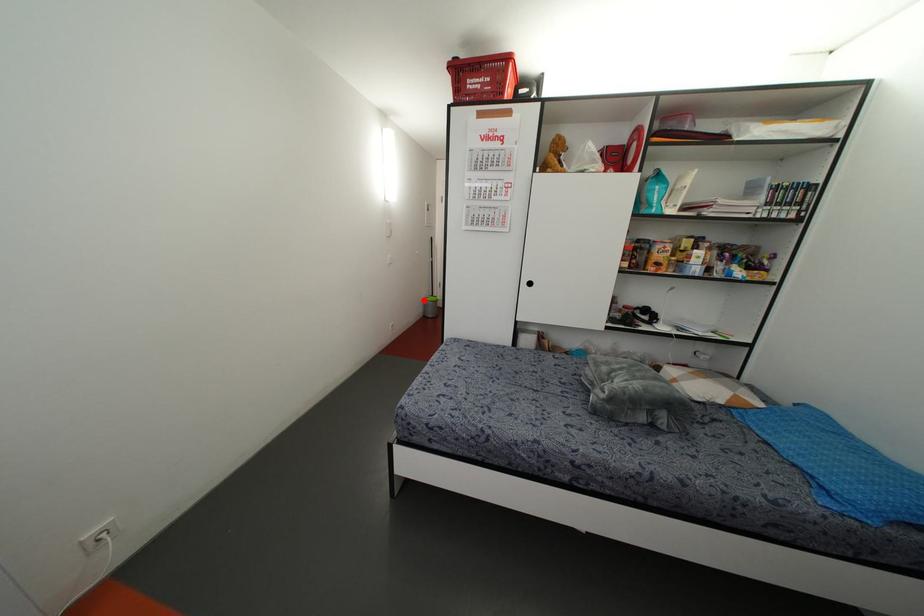
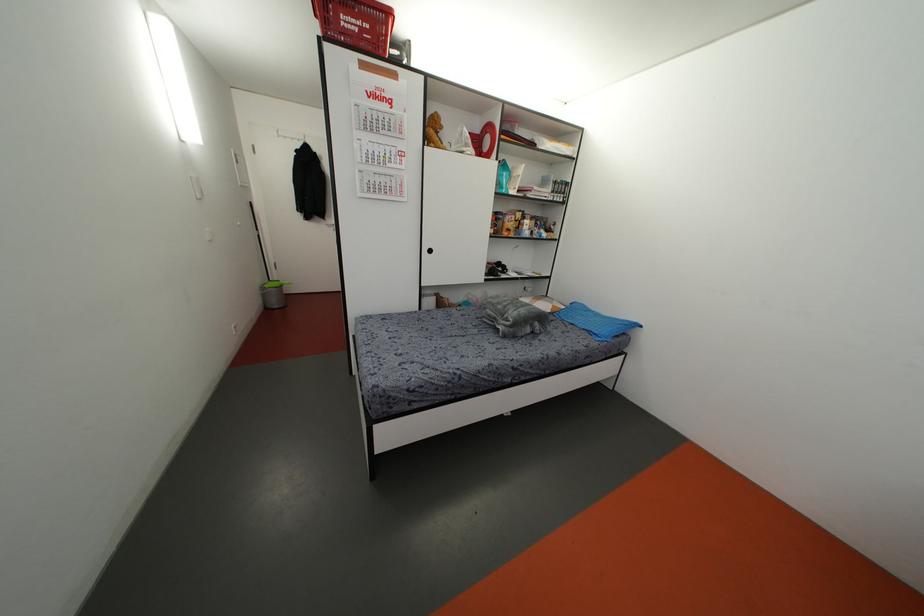
Locate, in the second image, the point that corresponds to the highlighted location in the first image.

(261, 288)